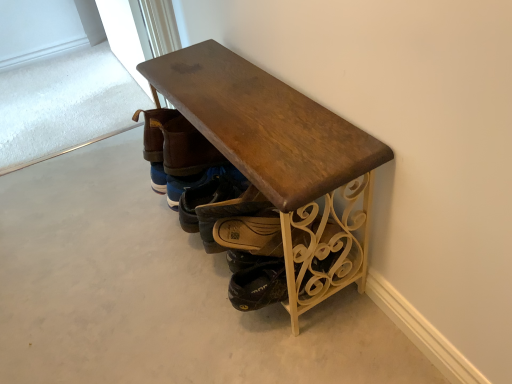
What do you see at coordinates (210, 194) in the screenshot?
I see `brown leather shoe at center, acting as the 3th footwear starting from the front` at bounding box center [210, 194].

What is the approximate width of brown leather boot at center, arranged as the first footwear when viewed from the back?

It is 5.66 inches.

Locate an element on the screen. brown leather shoe at center, acting as the 2th footwear starting from the back is located at coordinates (210, 194).

From a real-world perspective, is brown leather shoe at center, acting as the 2th footwear starting from the back, positioned above or below brown leather boot at center, which is the fourth footwear in front-to-back order?

brown leather shoe at center, acting as the 2th footwear starting from the back, is situated lower than brown leather boot at center, which is the fourth footwear in front-to-back order, in the real world.

Which is closer, (198, 200) or (177, 113)?

Clearly, point (198, 200) is more distant from the camera than point (177, 113).

Based on their sizes in the image, would you say brown leather shoe at center, acting as the 2th footwear starting from the back, is bigger or smaller than brown leather boot at center, which is the fourth footwear in front-to-back order?

In the image, brown leather shoe at center, acting as the 2th footwear starting from the back, appears to be larger than brown leather boot at center, which is the fourth footwear in front-to-back order.

What's the angular difference between brown leather boot at center, which is the fourth footwear in front-to-back order, and brown leather shoe at center, positioned as the 2th footwear in front-to-back order,'s facing directions?

The facing directions of brown leather boot at center, which is the fourth footwear in front-to-back order, and brown leather shoe at center, positioned as the 2th footwear in front-to-back order, are 0.000792 degrees apart.

Which of these two, brown leather boot at center, arranged as the first footwear when viewed from the back, or brown leather shoe at center, the third footwear viewed from the back, is wider?

brown leather shoe at center, the third footwear viewed from the back.

Considering the relative sizes of brown leather boot at center, which is the fourth footwear in front-to-back order, and brown leather shoe at center, positioned as the 2th footwear in front-to-back order, in the image provided, is brown leather boot at center, which is the fourth footwear in front-to-back order, smaller than brown leather shoe at center, positioned as the 2th footwear in front-to-back order,?

No, brown leather boot at center, which is the fourth footwear in front-to-back order, is not smaller than brown leather shoe at center, positioned as the 2th footwear in front-to-back order.

Is the surface of brown leather boot at center, which is the fourth footwear in front-to-back order, in direct contact with brown leather shoe at center, the third footwear viewed from the back?

brown leather boot at center, which is the fourth footwear in front-to-back order, and brown leather shoe at center, the third footwear viewed from the back, are clearly separated.

Is brown leather shoe at center, positioned as the 2th footwear in front-to-back order, oriented away from brown leather shoes at center, marked as the 4th footwear in a back-to-front arrangement?

Yes, brown leather shoe at center, positioned as the 2th footwear in front-to-back order,'s orientation is away from brown leather shoes at center, marked as the 4th footwear in a back-to-front arrangement.

Is brown leather shoe at center, the third footwear viewed from the back, thinner than brown leather shoes at center, acting as the first footwear starting from the front?

Correct, the width of brown leather shoe at center, the third footwear viewed from the back, is less than that of brown leather shoes at center, acting as the first footwear starting from the front.

Relative to brown leather shoes at center, acting as the first footwear starting from the front, is brown leather shoe at center, positioned as the 2th footwear in front-to-back order, in front or behind?

brown leather shoe at center, positioned as the 2th footwear in front-to-back order, is positioned farther from the viewer than brown leather shoes at center, acting as the first footwear starting from the front.

Based on the photo, can you confirm if brown leather shoe at center, the third footwear viewed from the back, is smaller than brown leather boot at center, arranged as the first footwear when viewed from the back?

Indeed, brown leather shoe at center, the third footwear viewed from the back, has a smaller size compared to brown leather boot at center, arranged as the first footwear when viewed from the back.

Is brown leather shoe at center, positioned as the 2th footwear in front-to-back order, located outside brown leather boot at center, arranged as the first footwear when viewed from the back?

brown leather shoe at center, positioned as the 2th footwear in front-to-back order, is positioned outside brown leather boot at center, arranged as the first footwear when viewed from the back.

Which is behind, brown leather shoe at center, positioned as the 2th footwear in front-to-back order, or brown leather boot at center, arranged as the first footwear when viewed from the back?

brown leather boot at center, arranged as the first footwear when viewed from the back, is more distant.

How far apart are brown leather shoe at center, positioned as the 2th footwear in front-to-back order, and brown leather boot at center, which is the fourth footwear in front-to-back order?

11.60 inches.

Considering the positions of objects brown leather shoe at center, acting as the 3th footwear starting from the front, and brown leather shoe at center, the third footwear viewed from the back, in the image provided, who is more to the left, brown leather shoe at center, acting as the 3th footwear starting from the front, or brown leather shoe at center, the third footwear viewed from the back,?

Positioned to the left is brown leather shoe at center, acting as the 3th footwear starting from the front.

Which point is more distant from viewer, (229,181) or (205,221)?

The point (229,181) is behind.

Between brown leather shoe at center, acting as the 2th footwear starting from the back, and brown leather shoe at center, the third footwear viewed from the back, which one has smaller width?

Thinner between the two is brown leather shoe at center, the third footwear viewed from the back.

Is brown leather shoe at center, acting as the 2th footwear starting from the back, aimed at brown leather shoe at center, the third footwear viewed from the back?

No, brown leather shoe at center, acting as the 2th footwear starting from the back, is not aimed at brown leather shoe at center, the third footwear viewed from the back.

Is brown leather shoes at center, acting as the first footwear starting from the front, smaller than brown leather shoe at center, positioned as the 2th footwear in front-to-back order?

No.

Between brown leather shoes at center, acting as the first footwear starting from the front, and brown leather shoe at center, the third footwear viewed from the back, which one has more height?

brown leather shoes at center, acting as the first footwear starting from the front.

From a real-world perspective, does brown leather shoes at center, marked as the 4th footwear in a back-to-front arrangement, stand above brown leather shoe at center, positioned as the 2th footwear in front-to-back order?

No, from a real-world perspective, brown leather shoes at center, marked as the 4th footwear in a back-to-front arrangement, is not above brown leather shoe at center, positioned as the 2th footwear in front-to-back order.

Consider the image. How far apart are brown leather shoes at center, marked as the 4th footwear in a back-to-front arrangement, and brown leather shoe at center, positioned as the 2th footwear in front-to-back order?

The distance of brown leather shoes at center, marked as the 4th footwear in a back-to-front arrangement, from brown leather shoe at center, positioned as the 2th footwear in front-to-back order, is 4.44 inches.

Is point (195, 223) more distant than point (154, 122)?

That is True.

Between brown leather shoe at center, acting as the 2th footwear starting from the back, and brown leather shoes at center, marked as the 4th footwear in a back-to-front arrangement, which one has less height?

Standing shorter between the two is brown leather shoe at center, acting as the 2th footwear starting from the back.

From a real-world perspective, which object rests below the other?

In real-world perspective, brown leather shoe at center, acting as the 3th footwear starting from the front, is lower.

From the image's perspective, is brown leather shoe at center, acting as the 2th footwear starting from the back, located above or below brown leather shoes at center, acting as the first footwear starting from the front?

brown leather shoe at center, acting as the 2th footwear starting from the back, is situated lower than brown leather shoes at center, acting as the first footwear starting from the front, in the image.

From the brown leather boot at center, which is the fourth footwear in front-to-back order, count 1st footwears forward and point to it. Please provide its 2D coordinates.

[(210, 194)]

The width and height of the screenshot is (512, 384). What are the coordinates of `the 2nd footwear counting from the left of the brown leather shoe at center, the third footwear viewed from the back` in the screenshot? It's located at (155, 144).

Based on their spatial positions, is brown leather shoe at center, acting as the 2th footwear starting from the back, or brown leather shoe at center, positioned as the 2th footwear in front-to-back order, further from brown leather boot at center, which is the fourth footwear in front-to-back order?

brown leather shoe at center, positioned as the 2th footwear in front-to-back order, is positioned further to the anchor brown leather boot at center, which is the fourth footwear in front-to-back order.

Looking at the image, which one is located closer to brown leather shoes at center, acting as the first footwear starting from the front, brown leather shoe at center, positioned as the 2th footwear in front-to-back order, or brown leather boot at center, which is the fourth footwear in front-to-back order?

brown leather shoe at center, positioned as the 2th footwear in front-to-back order.

Looking at the image, which one is located closer to brown leather shoe at center, acting as the 3th footwear starting from the front, brown leather shoes at center, marked as the 4th footwear in a back-to-front arrangement, or brown leather shoe at center, the third footwear viewed from the back?

brown leather shoe at center, the third footwear viewed from the back, is closer to brown leather shoe at center, acting as the 3th footwear starting from the front.

Which object lies further to the anchor point brown leather shoe at center, acting as the 3th footwear starting from the front, brown leather shoe at center, positioned as the 2th footwear in front-to-back order, or brown leather boot at center, which is the fourth footwear in front-to-back order?

brown leather boot at center, which is the fourth footwear in front-to-back order.

Looking at the image, which one is located further to brown leather shoe at center, acting as the 3th footwear starting from the front, brown leather shoes at center, acting as the first footwear starting from the front, or brown leather boot at center, arranged as the first footwear when viewed from the back?

brown leather boot at center, arranged as the first footwear when viewed from the back, lies further to brown leather shoe at center, acting as the 3th footwear starting from the front, than the other object.

When comparing their distances from brown leather boot at center, arranged as the first footwear when viewed from the back, does brown leather shoe at center, acting as the 3th footwear starting from the front, or brown leather shoes at center, acting as the first footwear starting from the front, seem further?

brown leather shoe at center, acting as the 3th footwear starting from the front, lies further to brown leather boot at center, arranged as the first footwear when viewed from the back, than the other object.

Estimate the real-world distances between objects in this image. Which object is closer to brown leather boot at center, arranged as the first footwear when viewed from the back, brown leather shoe at center, positioned as the 2th footwear in front-to-back order, or brown leather shoe at center, acting as the 3th footwear starting from the front?

Among the two, brown leather shoe at center, acting as the 3th footwear starting from the front, is located nearer to brown leather boot at center, arranged as the first footwear when viewed from the back.

Estimate the real-world distances between objects in this image. Which object is further from brown leather shoes at center, acting as the first footwear starting from the front, brown leather shoe at center, acting as the 2th footwear starting from the back, or brown leather shoe at center, the third footwear viewed from the back?

Based on the image, brown leather shoe at center, the third footwear viewed from the back, appears to be further to brown leather shoes at center, acting as the first footwear starting from the front.

The height and width of the screenshot is (384, 512). Find the location of `footwear between brown leather shoes at center, marked as the 4th footwear in a back-to-front arrangement, and brown leather shoe at center, acting as the 2th footwear starting from the back, in the front-back direction`. footwear between brown leather shoes at center, marked as the 4th footwear in a back-to-front arrangement, and brown leather shoe at center, acting as the 2th footwear starting from the back, in the front-back direction is located at coordinates (229, 214).

At what (x,y) coordinates should I click in order to perform the action: click on footwear between brown leather boot at center, arranged as the first footwear when viewed from the back, and brown leather shoe at center, the third footwear viewed from the back, from left to right. Please return your answer as a coordinate pair (x, y). Image resolution: width=512 pixels, height=384 pixels. Looking at the image, I should click on (210, 194).